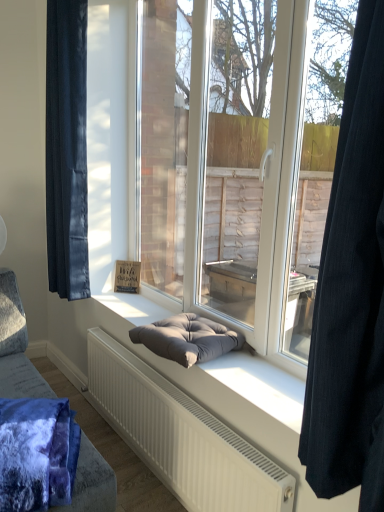
Question: Is velvety blue blanket at lower left bigger than dark gray cushion at center?

Choices:
 (A) yes
 (B) no

Answer: (A)

Question: Is velvety blue blanket at lower left located outside dark gray cushion at center?

Choices:
 (A) no
 (B) yes

Answer: (B)

Question: Is velvety blue blanket at lower left at the right side of dark gray cushion at center?

Choices:
 (A) yes
 (B) no

Answer: (B)

Question: Would you say dark gray cushion at center is part of velvety blue blanket at lower left's contents?

Choices:
 (A) no
 (B) yes

Answer: (A)

Question: Can you confirm if velvety blue blanket at lower left is smaller than dark gray cushion at center?

Choices:
 (A) no
 (B) yes

Answer: (A)

Question: Is velvety blue blanket at lower left behind dark gray cushion at center?

Choices:
 (A) yes
 (B) no

Answer: (B)

Question: From a real-world perspective, is velvet dark blue curtain at left, the first curtain when ordered from back to front, on top of velvety blue blanket at lower left?

Choices:
 (A) yes
 (B) no

Answer: (A)

Question: Is velvet dark blue curtain at left, arranged as the first curtain when viewed from the left, closer to the viewer compared to velvety blue blanket at lower left?

Choices:
 (A) yes
 (B) no

Answer: (B)

Question: From a real-world perspective, is velvet dark blue curtain at left, which is the second curtain from front to back, located beneath velvety blue blanket at lower left?

Choices:
 (A) no
 (B) yes

Answer: (A)

Question: Considering the relative positions of velvet dark blue curtain at left, which appears as the 2th curtain when viewed from the right, and velvety blue blanket at lower left in the image provided, is velvet dark blue curtain at left, which appears as the 2th curtain when viewed from the right, to the left of velvety blue blanket at lower left from the viewer's perspective?

Choices:
 (A) no
 (B) yes

Answer: (B)

Question: Is velvet dark blue curtain at left, which appears as the 2th curtain when viewed from the right, aimed at velvety blue blanket at lower left?

Choices:
 (A) yes
 (B) no

Answer: (B)

Question: From the image's perspective, does velvet dark blue curtain at left, which appears as the 2th curtain when viewed from the right, appear lower than velvety blue blanket at lower left?

Choices:
 (A) yes
 (B) no

Answer: (B)

Question: From a real-world perspective, is black fabric curtain at right, acting as the second curtain starting from the back, located beneath velvety blue blanket at lower left?

Choices:
 (A) no
 (B) yes

Answer: (A)